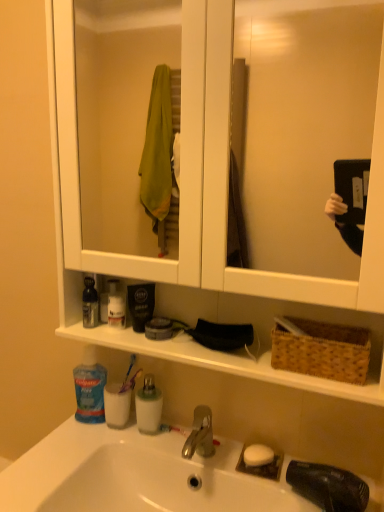
Locate an element on the screen. Image resolution: width=384 pixels, height=512 pixels. free space to the left of white matte soap at center is located at coordinates (205, 455).